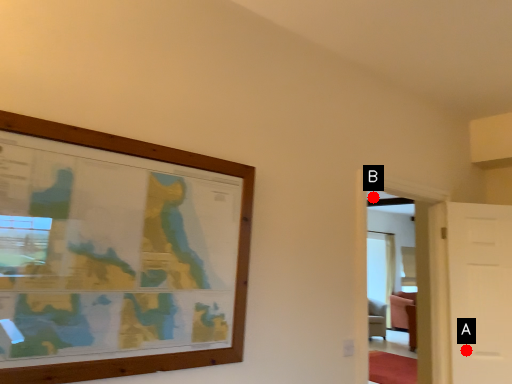
Question: Two points are circled on the image, labeled by A and B beside each circle. Which point is farther to the camera?

Choices:
 (A) A is further
 (B) B is further

Answer: (B)